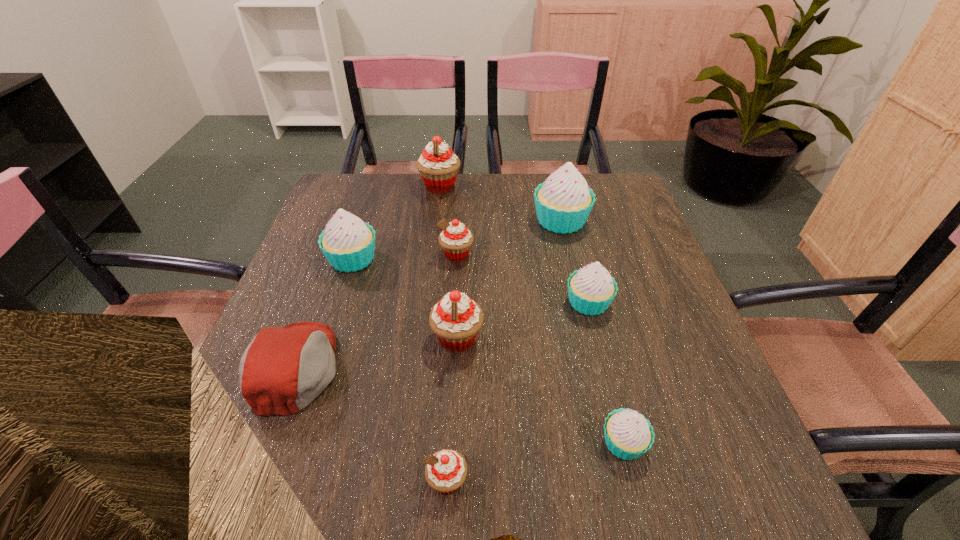
At what (x,y) coordinates should I click in order to perform the action: click on the farthest cupcake. Please return your answer as a coordinate pair (x, y). This screenshot has height=540, width=960. Looking at the image, I should click on (438, 165).

The height and width of the screenshot is (540, 960). Find the location of `the farthest object`. the farthest object is located at coordinates (438, 165).

Where is `the second farthest cupcake`? Image resolution: width=960 pixels, height=540 pixels. the second farthest cupcake is located at coordinates (563, 202).

This screenshot has height=540, width=960. Identify the location of the eighth nearest object. point(563,202).

At what (x,y) coordinates should I click in order to perform the action: click on the leftmost cupcake. Please return your answer as a coordinate pair (x, y). Looking at the image, I should click on (348, 243).

This screenshot has height=540, width=960. I want to click on the leftmost white cupcake, so click(348, 243).

Identify the location of the second nearest pink cupcake. (456, 320).

Image resolution: width=960 pixels, height=540 pixels. I want to click on the second smallest white cupcake, so 591,289.

The image size is (960, 540). I want to click on the third nearest pink cupcake, so click(456, 240).

The width and height of the screenshot is (960, 540). Find the location of `red cap`. red cap is located at coordinates (282, 370).